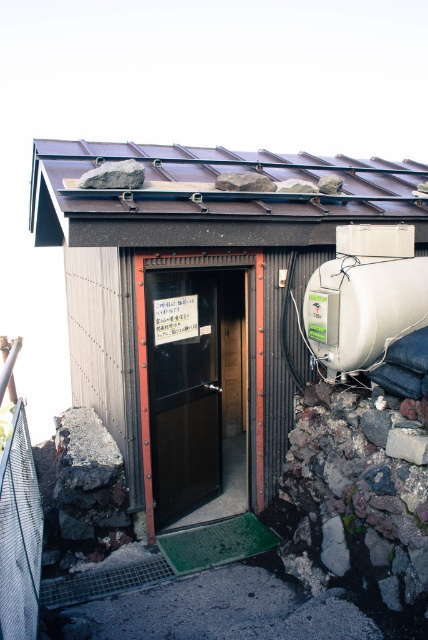
Question: Is matte black door at center wider than white matte water tank at upper right?

Choices:
 (A) no
 (B) yes

Answer: (B)

Question: Which of these objects is positioned farthest from the matte black door at center?

Choices:
 (A) white matte water tank at upper right
 (B) brown corrugated metal hut at center
 (C) brown corrugated metal roof at upper center

Answer: (C)

Question: Is brown corrugated metal hut at center to the left of brown corrugated metal roof at upper center from the viewer's perspective?

Choices:
 (A) yes
 (B) no

Answer: (A)

Question: Which object is the closest to the white matte water tank at upper right?

Choices:
 (A) brown corrugated metal roof at upper center
 (B) brown corrugated metal hut at center

Answer: (A)

Question: Is brown corrugated metal roof at upper center positioned in front of white matte water tank at upper right?

Choices:
 (A) yes
 (B) no

Answer: (A)

Question: Which of these objects is positioned closest to the brown corrugated metal roof at upper center?

Choices:
 (A) matte black door at center
 (B) white matte water tank at upper right

Answer: (B)